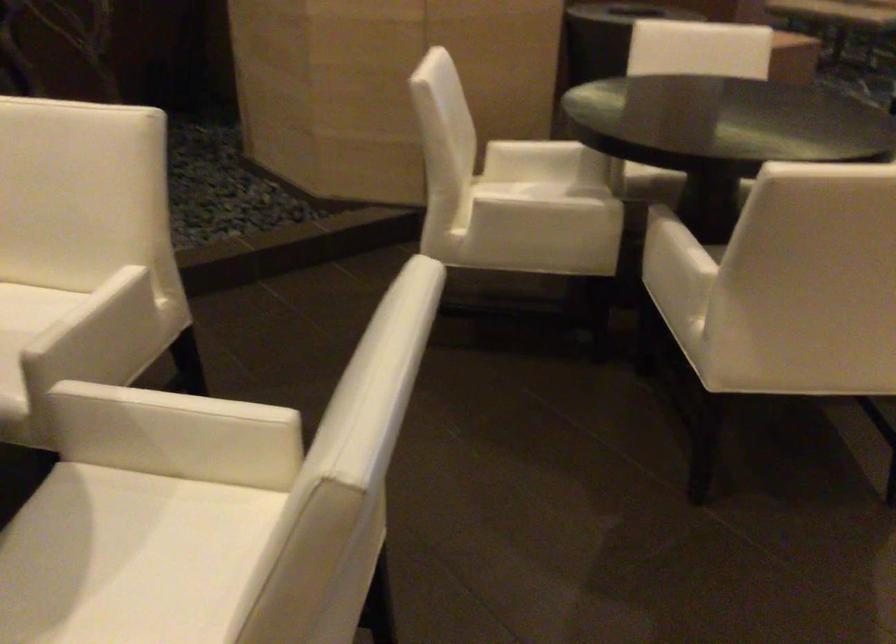
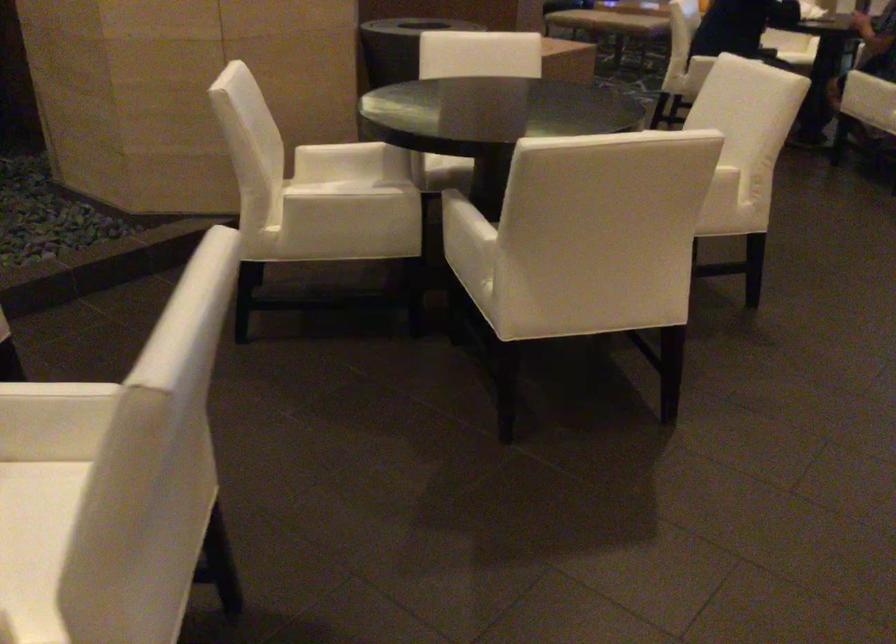
Question: In a continuous first-person perspective shot, in which direction is the camera moving?

Choices:
 (A) Left
 (B) Right
 (C) Forward
 (D) Backward

Answer: (D)